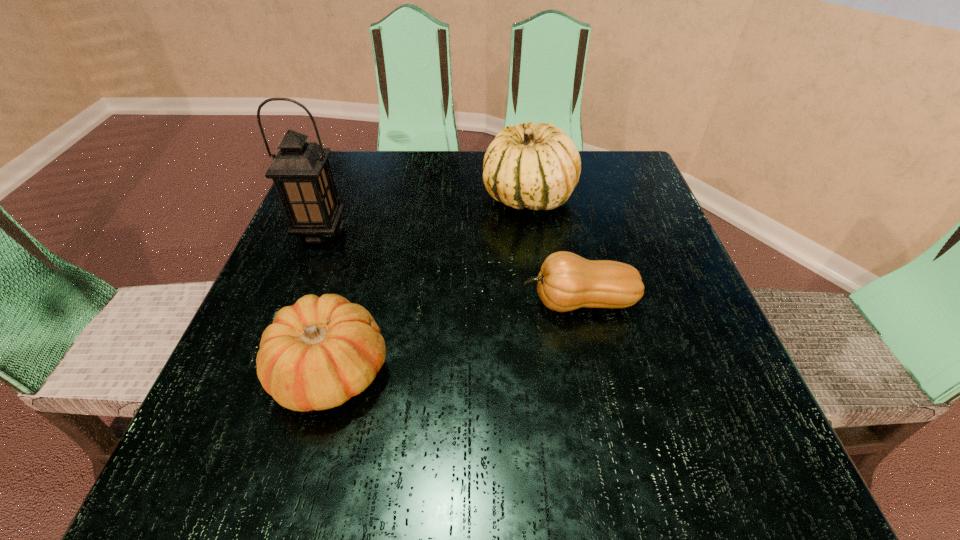
Locate an element on the screen. vacant space located 0.180m on the stem side of the second farthest gourd is located at coordinates (418, 302).

Locate an element on the screen. This screenshot has width=960, height=540. free space located on the stem side of the second farthest gourd is located at coordinates (464, 302).

This screenshot has height=540, width=960. Find the location of `object that is at the far edge`. object that is at the far edge is located at coordinates (537, 167).

Locate an element on the screen. lantern that is at the left edge is located at coordinates (301, 172).

Find the location of `gourd at the left edge`. gourd at the left edge is located at coordinates (318, 353).

Identify the location of object located in the right edge section of the desktop. [567, 281].

In the image, there is a desktop. Identify the location of vacant area at the far edge. The width and height of the screenshot is (960, 540). (429, 166).

Where is `free space at the near edge`? The height and width of the screenshot is (540, 960). free space at the near edge is located at coordinates (456, 436).

Identify the location of vacant space at the left edge of the desktop. [248, 404].

This screenshot has width=960, height=540. In order to click on free space at the right edge of the desktop in this screenshot , I will do `click(632, 382)`.